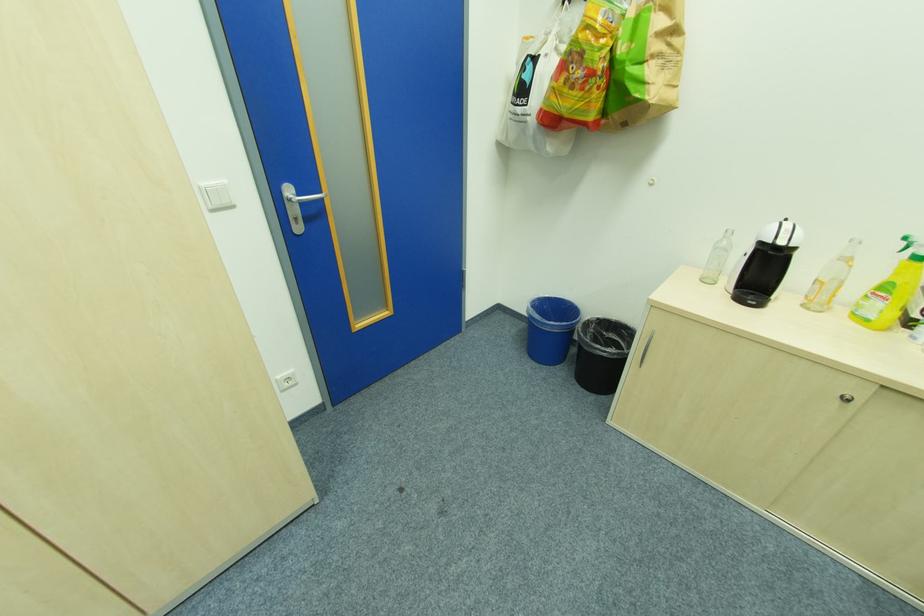
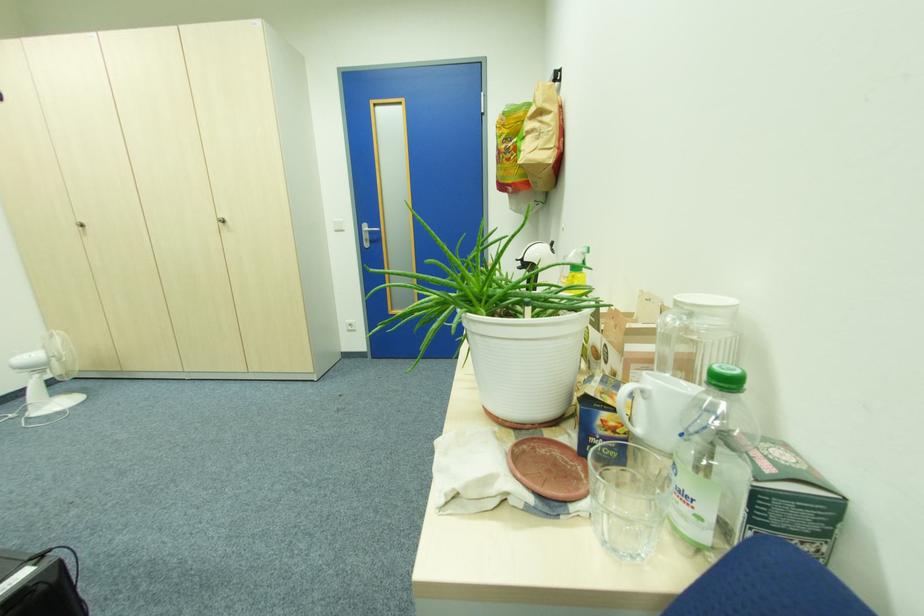
Where in the second image is the point corresponding to point (294, 193) from the first image?

(371, 229)